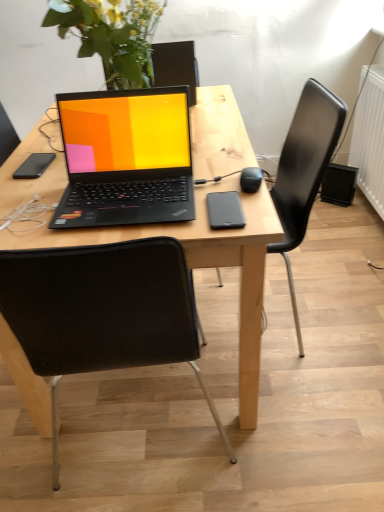
Question: Is black matte phone at left, acting as the second mobile phone starting from the front, in front of or behind black plastic chair at center, positioned as the first chair in right-to-left order, in the image?

Choices:
 (A) behind
 (B) front

Answer: (A)

Question: Do you think black matte phone at left, positioned as the first mobile phone in top-to-bottom order, is within black plastic chair at center, positioned as the first chair in right-to-left order, or outside of it?

Choices:
 (A) inside
 (B) outside

Answer: (B)

Question: Which of these objects is positioned farthest from the wooden desk at center?

Choices:
 (A) black plastic chair at center, positioned as the first chair in right-to-left order
 (B) white plastic radiator at right
 (C) black matte laptop at center
 (D) black matte phone at center, which appears as the 2th mobile phone when viewed from the back
 (E) black fabric chair at center, placed as the second chair when sorted from right to left

Answer: (B)

Question: Based on their relative distances, which object is nearer to the black plastic chair at center, positioned as the first chair in right-to-left order?

Choices:
 (A) black fabric chair at center, placed as the second chair when sorted from right to left
 (B) white plastic radiator at right
 (C) black matte phone at left, arranged as the second mobile phone when viewed from the right
 (D) black matte computer mouse at center-right
 (E) black matte laptop at center

Answer: (D)